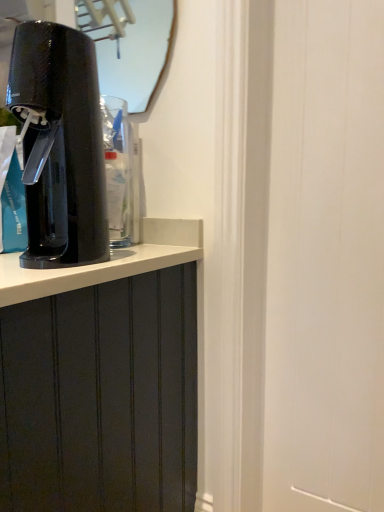
You are a GUI agent. You are given a task and a screenshot of the screen. Output one action in this format:
    pyautogui.click(x=<x>, y=<y>)
    Task: Click on the transparent plastic water cooler at left
    This screenshot has width=384, height=512.
    Given the screenshot: What is the action you would take?
    pyautogui.click(x=121, y=170)

Can matte glass mirror at upper center be found inside black glossy soda maker at left?

No, black glossy soda maker at left does not contain matte glass mirror at upper center.

Does point (103, 163) come behind point (138, 20)?

No, (103, 163) is closer to viewer.

Which is in front, black glossy soda maker at left or matte glass mirror at upper center?

black glossy soda maker at left.

Which point is more distant from viewer, [73,76] or [123,244]?

Positioned behind is point [123,244].

Is black glossy soda maker at left next to transparent plastic water cooler at left and touching it?

black glossy soda maker at left and transparent plastic water cooler at left are clearly separated.

Is black glossy soda maker at left facing away from transparent plastic water cooler at left?

Yes.

Is point (146, 64) closer or farther from the camera than point (36, 234)?

Point (146, 64) appears to be farther away from the viewer than point (36, 234).

Between matte glass mirror at upper center and black glossy soda maker at left, which one has larger width?

black glossy soda maker at left.

This screenshot has height=512, width=384. Identify the location of home appliance on the left of matte glass mirror at upper center. (60, 145).

Would you say matte glass mirror at upper center is to the left or to the right of black glossy soda maker at left in the picture?

matte glass mirror at upper center is positioned on black glossy soda maker at left's right side.

Is matte glass mirror at upper center facing towards transparent plastic water cooler at left?

No, matte glass mirror at upper center is not facing towards transparent plastic water cooler at left.

Is matte glass mirror at upper center thinner than transparent plastic water cooler at left?

Yes.

Visually, is matte glass mirror at upper center positioned to the left or to the right of transparent plastic water cooler at left?

From the image, it's evident that matte glass mirror at upper center is to the right of transparent plastic water cooler at left.

From the image's perspective, is transparent plastic water cooler at left on top of black glossy soda maker at left?

Indeed, from the image's perspective, transparent plastic water cooler at left is shown above black glossy soda maker at left.

From a real-world perspective, relative to black glossy soda maker at left, is transparent plastic water cooler at left vertically above or below?

transparent plastic water cooler at left is below black glossy soda maker at left.

Between transparent plastic water cooler at left and black glossy soda maker at left, which one has larger width?

black glossy soda maker at left.

Looking at this image, would you say transparent plastic water cooler at left is a long distance from black glossy soda maker at left?

No, there isn't a large distance between transparent plastic water cooler at left and black glossy soda maker at left.

Is point (116, 246) closer or farther from the camera than point (80, 13)?

Point (116, 246) is positioned closer to the camera compared to point (80, 13).

From a real-world perspective, does transparent plastic water cooler at left stand above matte glass mirror at upper center?

No, from a real-world perspective, transparent plastic water cooler at left is not on top of matte glass mirror at upper center.

How many degrees apart are the facing directions of transparent plastic water cooler at left and matte glass mirror at upper center?

There is a 3.74-degree angle between the facing directions of transparent plastic water cooler at left and matte glass mirror at upper center.

Does transparent plastic water cooler at left lie behind matte glass mirror at upper center?

That is False.

There is a black glossy soda maker at left. Where is `mirror above it (from a real-world perspective)`? mirror above it (from a real-world perspective) is located at coordinates (129, 45).

The image size is (384, 512). I want to click on home appliance below the transparent plastic water cooler at left (from the image's perspective), so click(x=60, y=145).

Estimate the real-world distances between objects in this image. Which object is further from matte glass mirror at upper center, transparent plastic water cooler at left or black glossy soda maker at left?

black glossy soda maker at left is positioned further to the anchor matte glass mirror at upper center.

Which object lies nearer to the anchor point black glossy soda maker at left, transparent plastic water cooler at left or matte glass mirror at upper center?

transparent plastic water cooler at left is closer to black glossy soda maker at left.

Looking at the image, which one is located closer to matte glass mirror at upper center, black glossy soda maker at left or transparent plastic water cooler at left?

The object closer to matte glass mirror at upper center is transparent plastic water cooler at left.

Estimate the real-world distances between objects in this image. Which object is closer to transparent plastic water cooler at left, matte glass mirror at upper center or black glossy soda maker at left?

black glossy soda maker at left is closer to transparent plastic water cooler at left.

Based on the photo, considering their positions, is matte glass mirror at upper center positioned closer to black glossy soda maker at left than transparent plastic water cooler at left?

transparent plastic water cooler at left is closer to black glossy soda maker at left.

Based on their spatial positions, is black glossy soda maker at left or matte glass mirror at upper center closer to transparent plastic water cooler at left?

Among the two, black glossy soda maker at left is located nearer to transparent plastic water cooler at left.

Locate an element on the screen. water cooler positioned between black glossy soda maker at left and matte glass mirror at upper center from near to far is located at coordinates (121, 170).